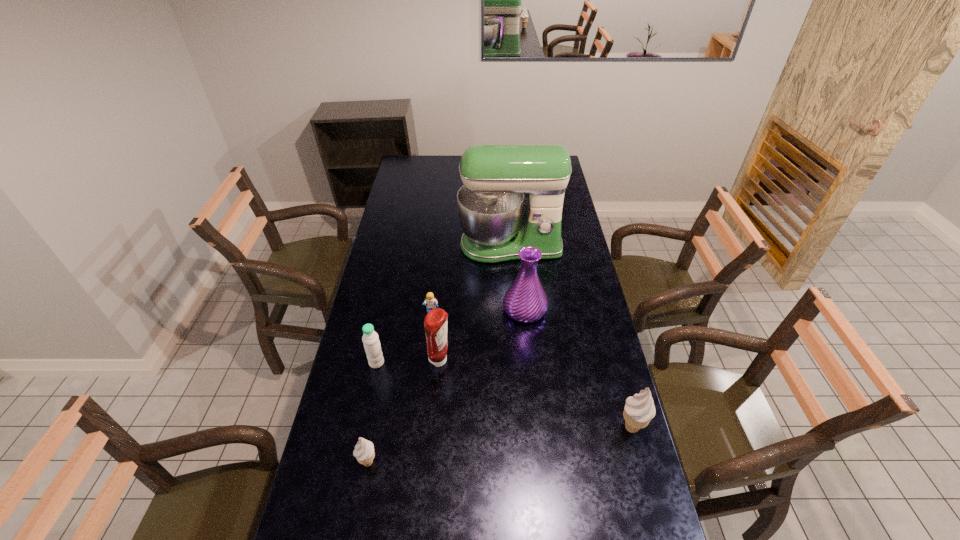
Locate an element on the screen. Image resolution: width=960 pixels, height=540 pixels. free spot that satisfies the following two spatial constraints: 1. on the controls of the farthest object; 2. on the front-facing side of the nearer icecream is located at coordinates (528, 463).

You are a GUI agent. You are given a task and a screenshot of the screen. Output one action in this format:
    pyautogui.click(x=<x>, y=<y>)
    Task: Click on the vacant space that satisfies the following two spatial constraints: 1. on the front-facing side of the condiment; 2. on the left side of the shortest object
    The image size is (960, 540).
    Given the screenshot: What is the action you would take?
    pyautogui.click(x=426, y=361)